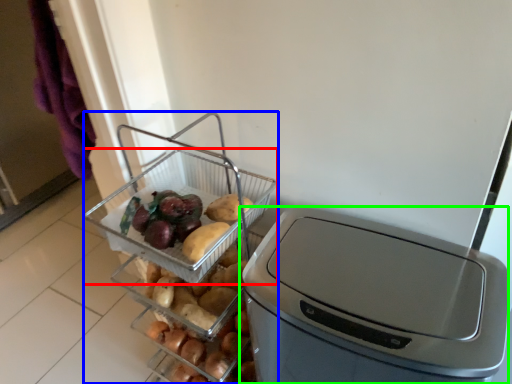
Question: Considering the real-world distances, which object is closest to basket (highlighted by a red box)? appliance (highlighted by a blue box) or home appliance (highlighted by a green box).

Choices:
 (A) appliance
 (B) home appliance

Answer: (A)